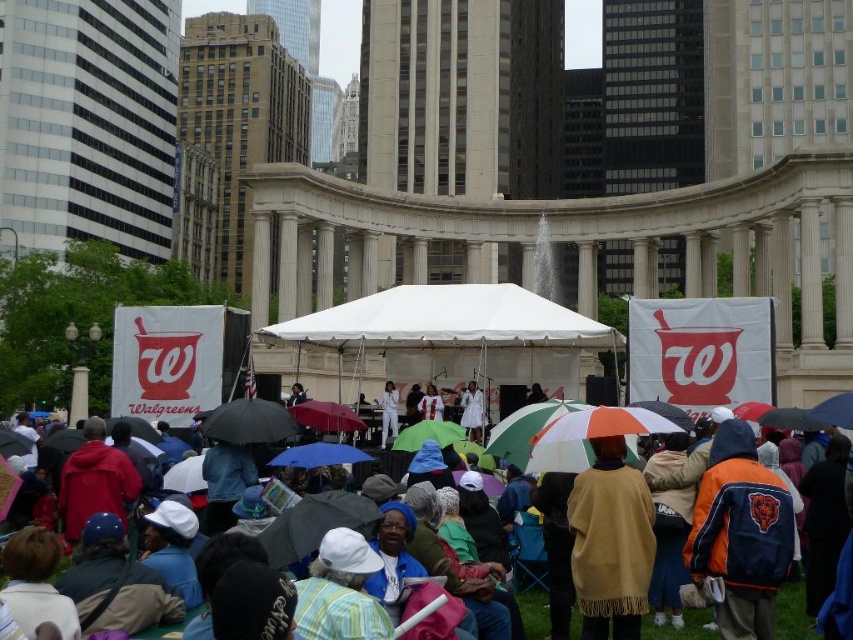
Can you confirm if red matte umbrella at center is shorter than green matte umbrella at center?

Yes.

Does red matte umbrella at center have a greater height compared to green matte umbrella at center?

No, red matte umbrella at center is not taller than green matte umbrella at center.

Is point (334, 408) farther from viewer compared to point (444, 433)?

Yes, point (334, 408) is behind point (444, 433).

In order to click on red matte umbrella at center in this screenshot , I will do `click(326, 417)`.

Consider the image. Can you confirm if orange fabric jacket at lower right is positioned to the left of red matte umbrella at center?

In fact, orange fabric jacket at lower right is to the right of red matte umbrella at center.

Can you confirm if orange fabric jacket at lower right is thinner than red matte umbrella at center?

Yes.

Who is more distant from viewer, [762,545] or [303,422]?

Positioned behind is point [303,422].

This screenshot has width=853, height=640. Find the location of `orange fabric jacket at lower right`. orange fabric jacket at lower right is located at coordinates (740, 532).

Is point (608, 604) in front of point (808, 637)?

Yes, it is.

This screenshot has width=853, height=640. What do you see at coordinates (610, 541) in the screenshot?
I see `tan wool poncho at center` at bounding box center [610, 541].

Where is `tan wool poncho at center`? tan wool poncho at center is located at coordinates (610, 541).